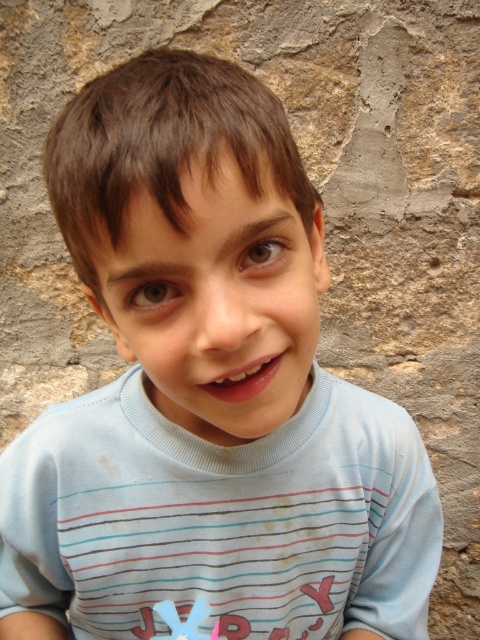
Is light blue cotton shirt at center below pink plastic toy at lower center?

No, light blue cotton shirt at center is not below pink plastic toy at lower center.

Which is below, light blue cotton shirt at center or pink plastic toy at lower center?

pink plastic toy at lower center is lower down.

This screenshot has height=640, width=480. I want to click on light blue cotton shirt at center, so pos(222,518).